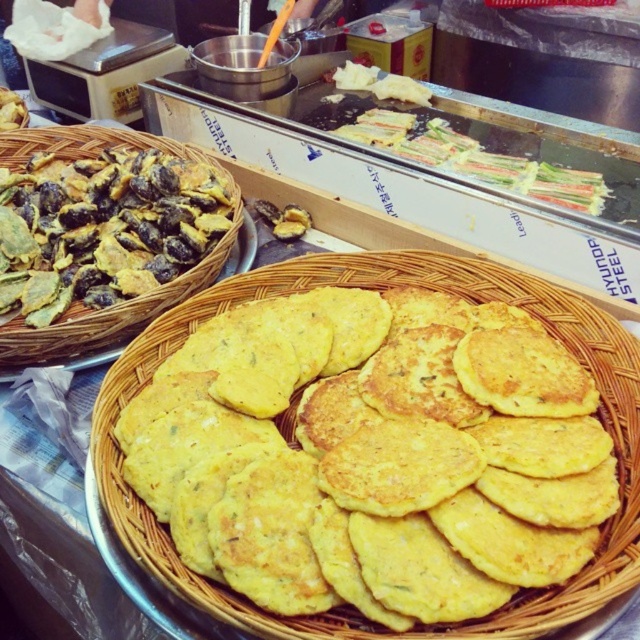
Question: Which point is closer to the camera?

Choices:
 (A) (620, 544)
 (B) (64, 221)

Answer: (A)

Question: Observing the image, what is the correct spatial positioning of yellow matte pancake basket at center in reference to yellow crispy chips at left?

Choices:
 (A) right
 (B) left

Answer: (A)

Question: Which point is closer to the camera?

Choices:
 (A) (630, 552)
 (B) (45, 276)

Answer: (A)

Question: Where is yellow matte pancake basket at center located in relation to yellow crispy chips at left in the image?

Choices:
 (A) right
 (B) left

Answer: (A)

Question: Does yellow matte pancake basket at center appear on the left side of yellow crispy chips at left?

Choices:
 (A) yes
 (B) no

Answer: (B)